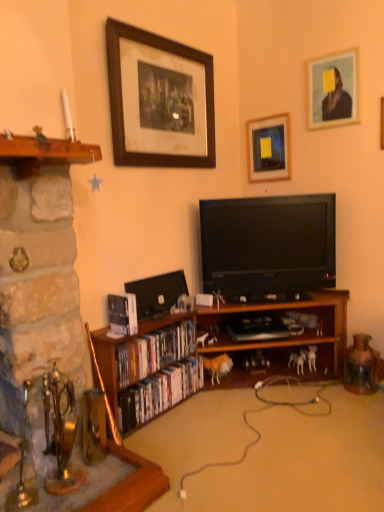
Where is `vacant space in between wooden bookshelf at center and rusty metal jug at lower right`? vacant space in between wooden bookshelf at center and rusty metal jug at lower right is located at coordinates (326, 426).